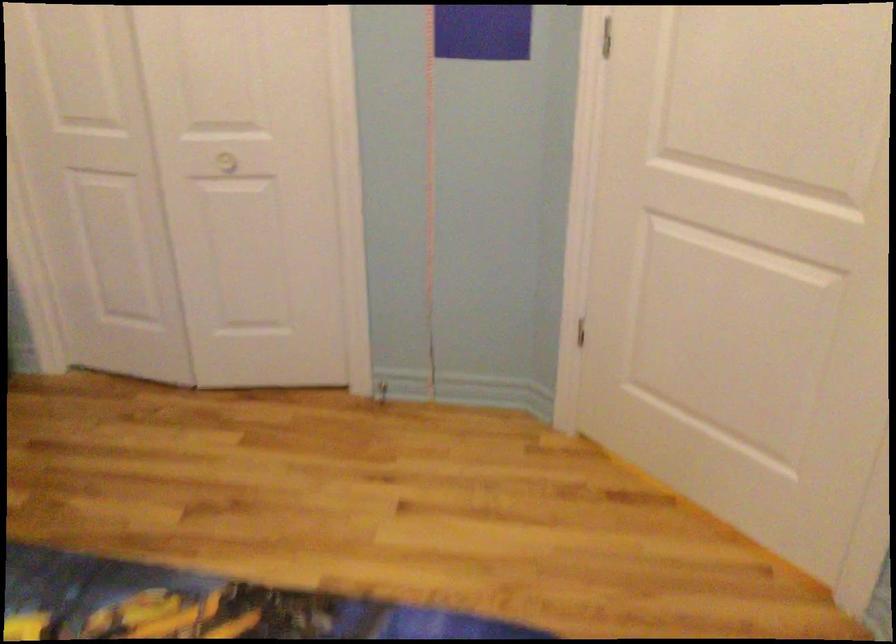
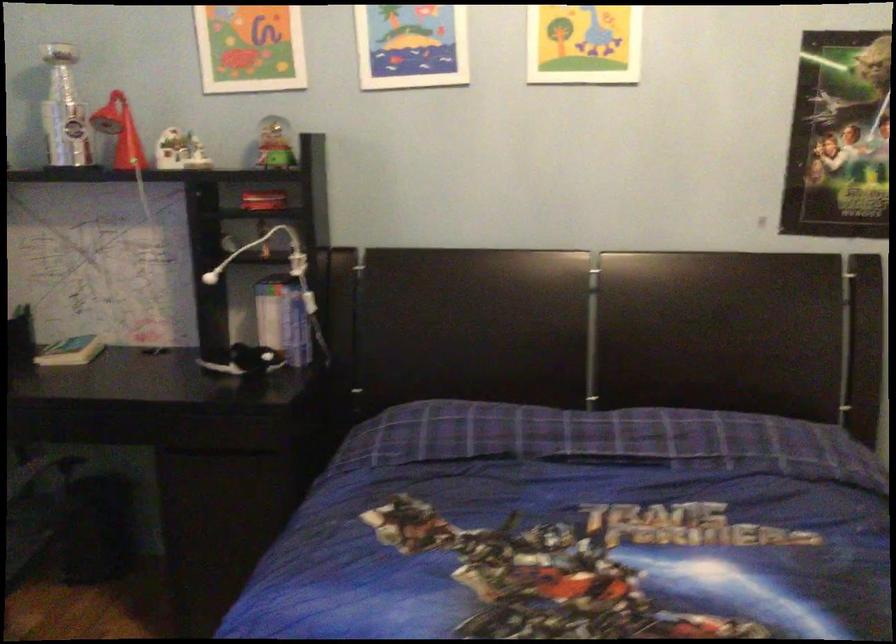
Question: The camera is either moving clockwise (left) or counter-clockwise (right) around the object. The first image is from the beginning of the video and the second image is from the end. Is the camera moving left or right when shooting the video?

Choices:
 (A) Left
 (B) Right

Answer: (B)